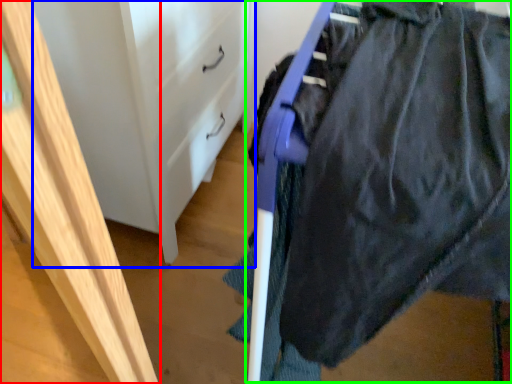
Question: Estimate the real-world distances between objects in this image. Which object is closer to furniture (highlighted by a red box), file cabinet (highlighted by a blue box) or wide (highlighted by a green box)?

Choices:
 (A) file cabinet
 (B) wide

Answer: (B)